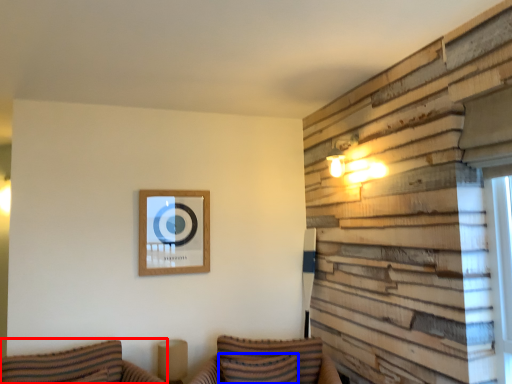
Question: Which of the following is the farthest to the observer, couch (highlighted by a red box) or pillow (highlighted by a blue box)?

Choices:
 (A) couch
 (B) pillow

Answer: (B)